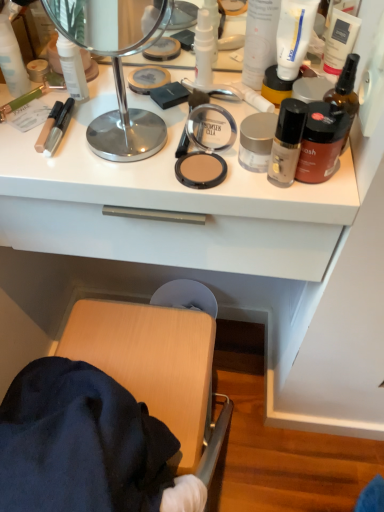
Question: Should I look upward or downward to see yellow matte jar at upper right, the 4th toiletry from the right?

Choices:
 (A) up
 (B) down

Answer: (A)

Question: Can you confirm if matte brown compact at center is thinner than white matte tube at upper right, which is the third toiletry in right-to-left order?

Choices:
 (A) no
 (B) yes

Answer: (A)

Question: Does matte brown compact at center have a lesser height compared to white matte tube at upper right, placed as the eighth toiletry when sorted from left to right?

Choices:
 (A) no
 (B) yes

Answer: (B)

Question: Does matte brown compact at center have a greater width compared to white matte tube at upper right, placed as the eighth toiletry when sorted from left to right?

Choices:
 (A) yes
 (B) no

Answer: (A)

Question: Does matte brown compact at center touch white matte tube at upper right, placed as the eighth toiletry when sorted from left to right?

Choices:
 (A) yes
 (B) no

Answer: (B)

Question: Considering the relative sizes of matte brown compact at center and white matte tube at upper right, placed as the eighth toiletry when sorted from left to right, in the image provided, is matte brown compact at center bigger than white matte tube at upper right, placed as the eighth toiletry when sorted from left to right,?

Choices:
 (A) yes
 (B) no

Answer: (B)

Question: From the image's perspective, would you say matte brown compact at center is shown under white matte tube at upper right, which is the third toiletry in right-to-left order?

Choices:
 (A) yes
 (B) no

Answer: (A)

Question: Can you confirm if matte brown compact at center is shorter than wooden stool at lower left?

Choices:
 (A) yes
 (B) no

Answer: (A)

Question: From a real-world perspective, is matte brown compact at center located higher than wooden stool at lower left?

Choices:
 (A) no
 (B) yes

Answer: (B)

Question: From the image's perspective, is matte brown compact at center located above wooden stool at lower left?

Choices:
 (A) no
 (B) yes

Answer: (B)

Question: Would you say wooden stool at lower left is part of matte brown compact at center's contents?

Choices:
 (A) yes
 (B) no

Answer: (B)

Question: Is matte brown compact at center wider than wooden stool at lower left?

Choices:
 (A) no
 (B) yes

Answer: (A)

Question: Can you confirm if matte brown compact at center is taller than wooden stool at lower left?

Choices:
 (A) yes
 (B) no

Answer: (B)

Question: Is white matte lotion at upper right, the fifth toiletry positioned from the left, behind white matte countertop at upper center?

Choices:
 (A) no
 (B) yes

Answer: (A)